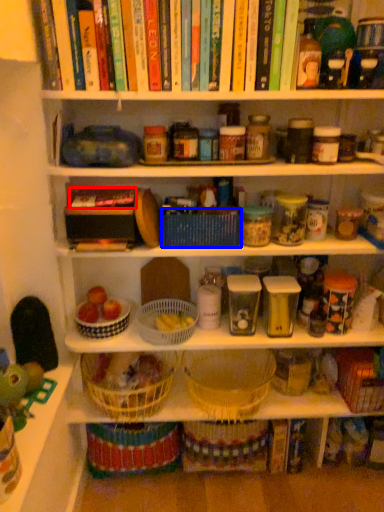
Question: Which point is closer to the camera, book (highlighted by a red box) or basket (highlighted by a blue box)?

Choices:
 (A) book
 (B) basket

Answer: (A)